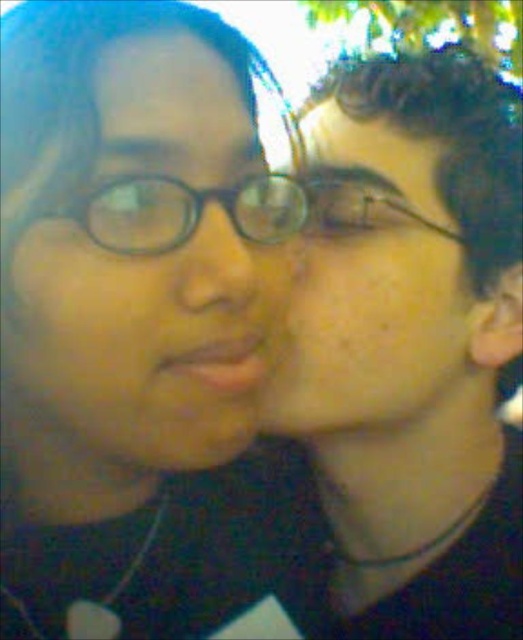
You are a photographer trying to focus on the face of the person on the right in the image. The camera uses a coordinate system where the bottom left corner is the origin. Can you confirm if the point at coordinates point (415, 346) falls within the face area of the person on the right?

Yes, the point (415, 346) is part of the smooth skin face at right, so it falls within the face area of the person on the right.

You are a photographer trying to capture a closeup shot of both the smooth skin face at right and the matte black glasses at left. Given that your camera has a depth of field that can focus clearly on objects within a 7.5 inch range, will both subjects be in focus?

The smooth skin face at right is 7.70 inches from the matte black glasses at left. Since the distance between them exceeds the camera s 7.5 inch depth of field range, the two subjects will not both be in focus simultaneously.

You are a photographer trying to focus on the smooth skin face at right and the black plastic glasses at center. Which object should you adjust your focus to first if you want to capture both clearly?

The black plastic glasses at center is behind the smooth skin face at right, so you should focus on the smooth skin face at right first to ensure both are in focus.